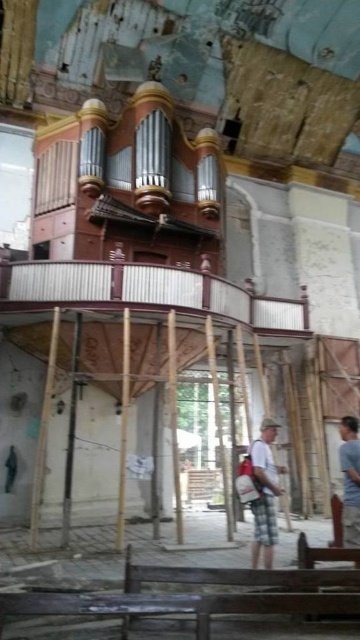
Looking at this image, does wooden bench at lower center appear under light brown wooden person at lower right?

Yes.

How much distance is there between wooden bench at lower center and light brown wooden person at lower right?

The distance of wooden bench at lower center from light brown wooden person at lower right is 2.21 meters.

This screenshot has height=640, width=360. In order to click on wooden bench at lower center in this screenshot , I will do `click(240, 593)`.

Find the location of `wooden bench at lower center`. wooden bench at lower center is located at coordinates (240, 593).

Which is more to the right, light brown plaid shorts at center or light brown wooden person at lower right?

light brown wooden person at lower right is more to the right.

The width and height of the screenshot is (360, 640). Find the location of `light brown plaid shorts at center`. light brown plaid shorts at center is located at coordinates [264, 493].

Is point (285, 584) less distant than point (261, 536)?

Yes, point (285, 584) is closer to viewer.

Identify the location of wooden bench at lower center. (240, 593).

Is point (339, 614) more distant than point (255, 500)?

No, (339, 614) is closer to viewer.

I want to click on wooden bench at lower center, so click(x=240, y=593).